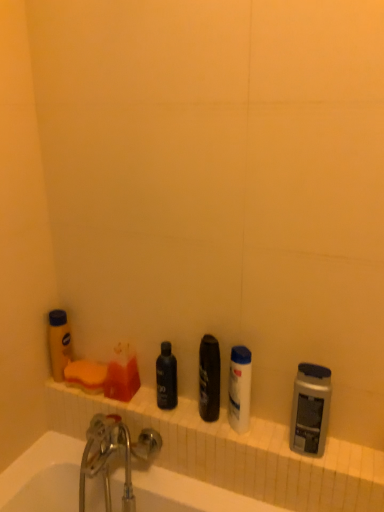
Locate an element on the screen. vacant space that is in between white plastic mouthwash at center and metallic gray shaver at right, marked as the fifth toiletry in a left-to-right arrangement is located at coordinates (264, 436).